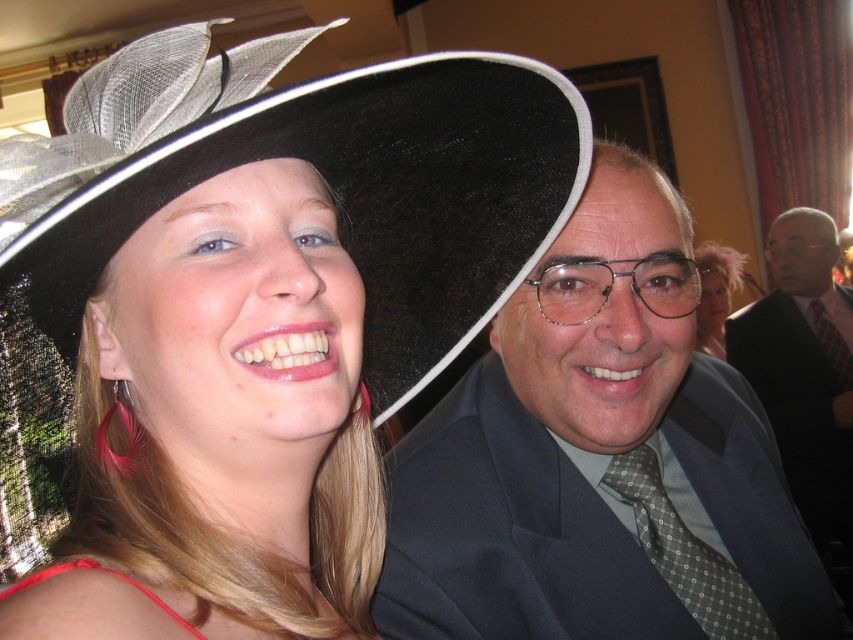
Can you confirm if black felt hat at upper left is smaller than red satin dress at lower left?

Incorrect, black felt hat at upper left is not smaller in size than red satin dress at lower left.

Does black felt hat at upper left appear over red satin dress at lower left?

Correct, black felt hat at upper left is located above red satin dress at lower left.

Does point (149, 212) come farther from viewer compared to point (141, 589)?

That is True.

At what (x,y) coordinates should I click in order to perform the action: click on black felt hat at upper left. Please return your answer as a coordinate pair (x, y). Image resolution: width=853 pixels, height=640 pixels. Looking at the image, I should click on (318, 172).

Between black felt hat at upper left and green textured tie at right, which one appears on the right side from the viewer's perspective?

Positioned to the right is green textured tie at right.

Is black felt hat at upper left further to camera compared to green textured tie at right?

No, it is in front of green textured tie at right.

Is point (387, 237) positioned in front of point (850, 372)?

Yes, point (387, 237) is in front of point (850, 372).

This screenshot has height=640, width=853. Find the location of `black felt hat at upper left`. black felt hat at upper left is located at coordinates (318, 172).

Is point (677, 298) behind point (701, 324)?

No, it is in front of (701, 324).

Is matte black hat at center above matte pink feather at upper right?

No.

In the scene shown: Who is more forward, (784, 512) or (703, 333)?

Positioned in front is point (784, 512).

The height and width of the screenshot is (640, 853). In order to click on matte black hat at center in this screenshot , I will do `click(599, 458)`.